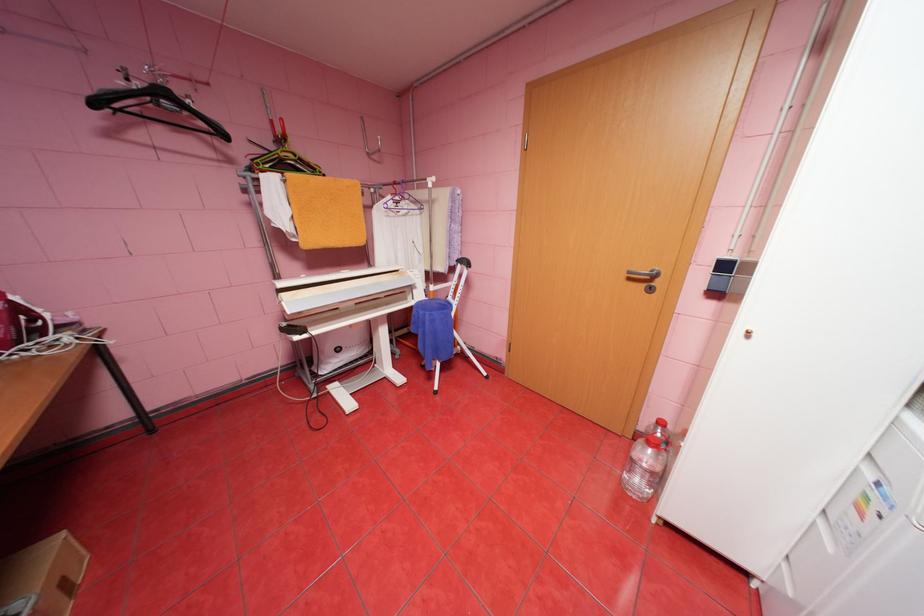
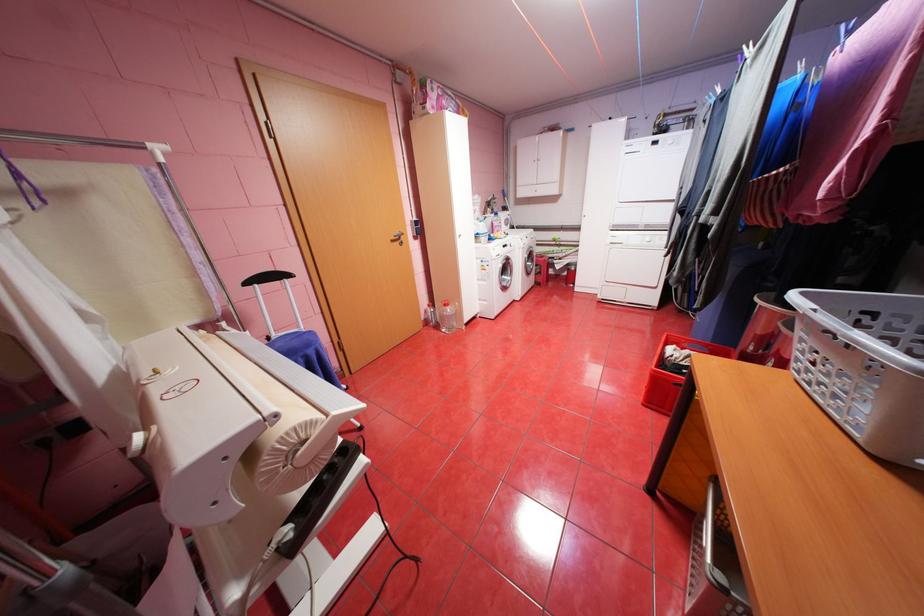
Locate, in the second image, the point that corresponds to (x=638, y=278) in the first image.

(400, 241)